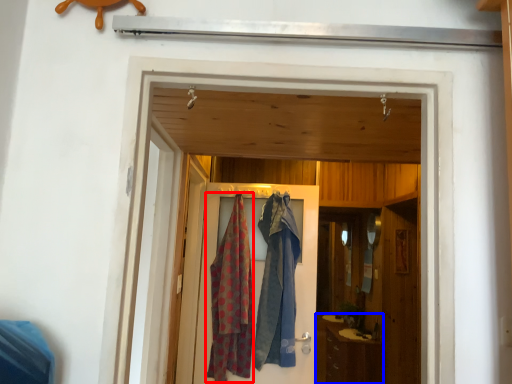
Question: Which point is closer to the camera, cloth (highlighted by a red box) or cabinetry (highlighted by a blue box)?

Choices:
 (A) cloth
 (B) cabinetry

Answer: (A)